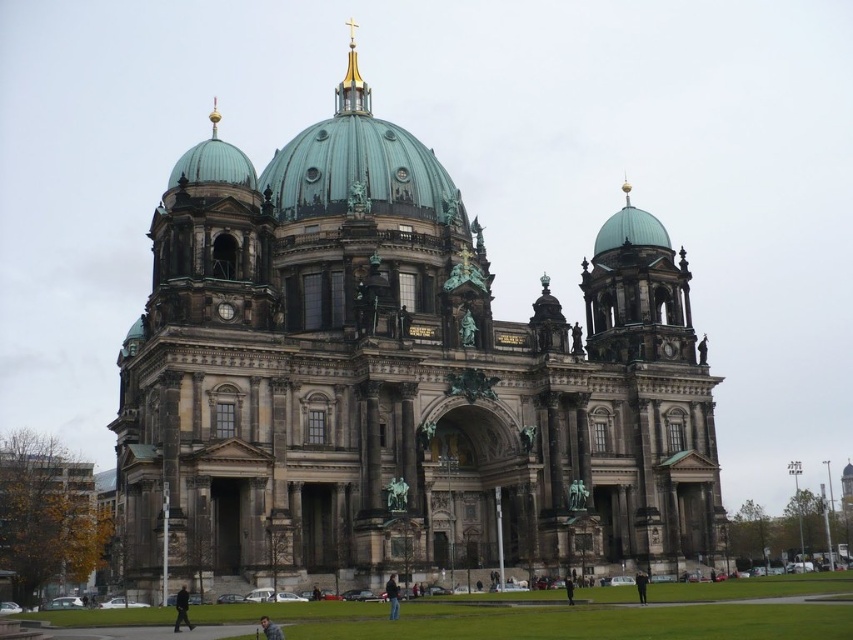
You are visiting the Berlin Cathedral and see the gold plated spire at upper center and the light brown leather jacket at center. Which object is taller?

The gold plated spire at upper center is taller than the light brown leather jacket at center.

You are standing in front of the Berlin Cathedral and notice the gold plated spire at upper center and the dark blue jeans at center. Which object is located higher up in the image?

The gold plated spire at upper center is positioned over the dark blue jeans at center, so it is higher up in the image.

In the scene shown: You are a tourist standing in front of the Berlin Cathedral. You notice the dark gray stone church at center and the gold plated spire at upper center. Which of these two objects is wider?

The dark gray stone church at center is wider than the gold plated spire at upper center.